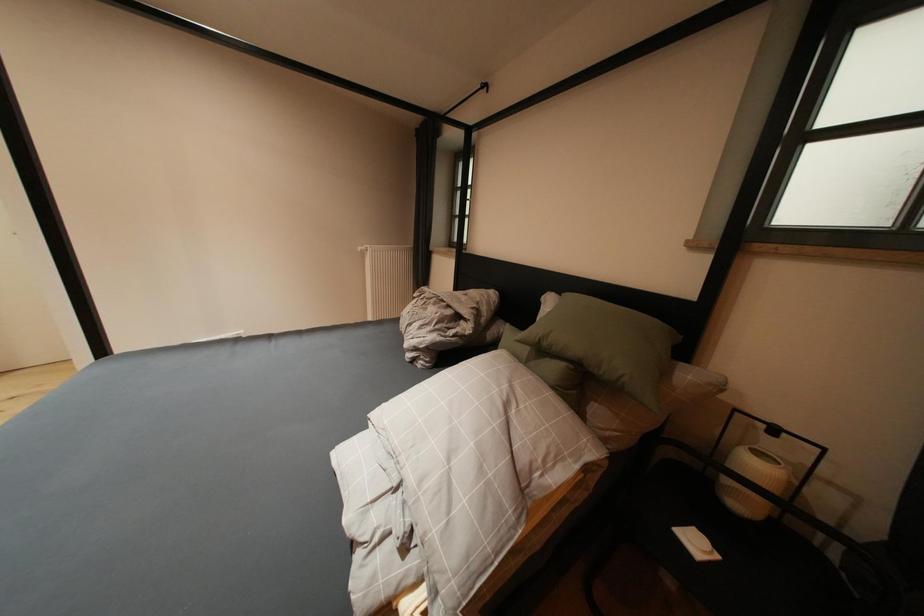
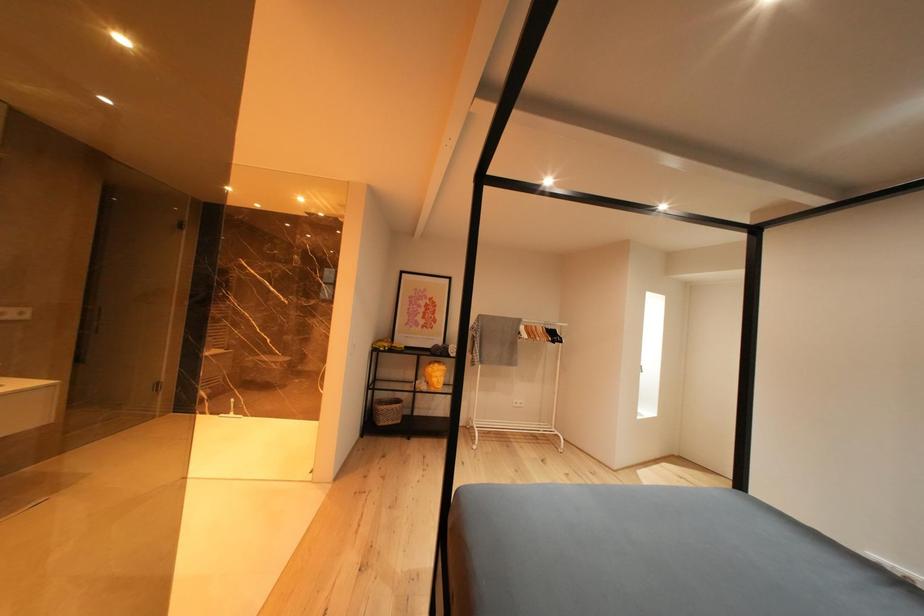
Question: How did the camera likely rotate?

Choices:
 (A) Left
 (B) Right
 (C) Up
 (D) Down

Answer: (A)